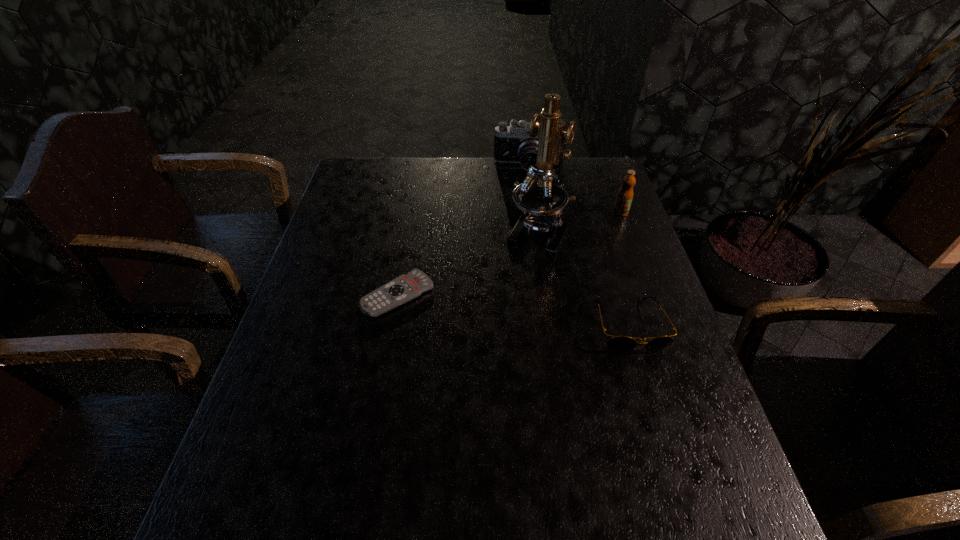
You are a GUI agent. You are given a task and a screenshot of the screen. Output one action in this format:
    pyautogui.click(x=<x>, y=<y>)
    Task: Click on the leftmost object
    This screenshot has height=540, width=960.
    Given the screenshot: What is the action you would take?
    pyautogui.click(x=406, y=287)

At what (x,y) coordinates should I click in order to perform the action: click on the shortest object. Please return your answer as a coordinate pair (x, y). Looking at the image, I should click on (406, 287).

Find the location of `sunglasses`. sunglasses is located at coordinates (617, 343).

Find the location of a particular element. The width and height of the screenshot is (960, 540). camera is located at coordinates (512, 144).

Find the location of a particular element. the tallest object is located at coordinates (542, 201).

I want to click on orange juice, so click(x=624, y=198).

You are a GUI agent. You are given a task and a screenshot of the screen. Output one action in this format:
    pyautogui.click(x=<x>, y=<y>)
    Task: Click on the free region located on the front of the remote control
    This screenshot has height=540, width=960.
    Given the screenshot: What is the action you would take?
    pyautogui.click(x=374, y=426)

You are a GUI agent. You are given a task and a screenshot of the screen. Output one action in this format:
    pyautogui.click(x=<x>, y=<y>)
    Task: Click on the free region located on the front-facing side of the fourth tallest object
    
    Given the screenshot: What is the action you would take?
    pyautogui.click(x=667, y=450)

Find the location of a particular element. The width and height of the screenshot is (960, 540). free space located on the front-facing side of the farthest object is located at coordinates (524, 246).

Identify the location of vacant region located 0.050m on the front-facing side of the farthest object. The height and width of the screenshot is (540, 960). tap(526, 187).